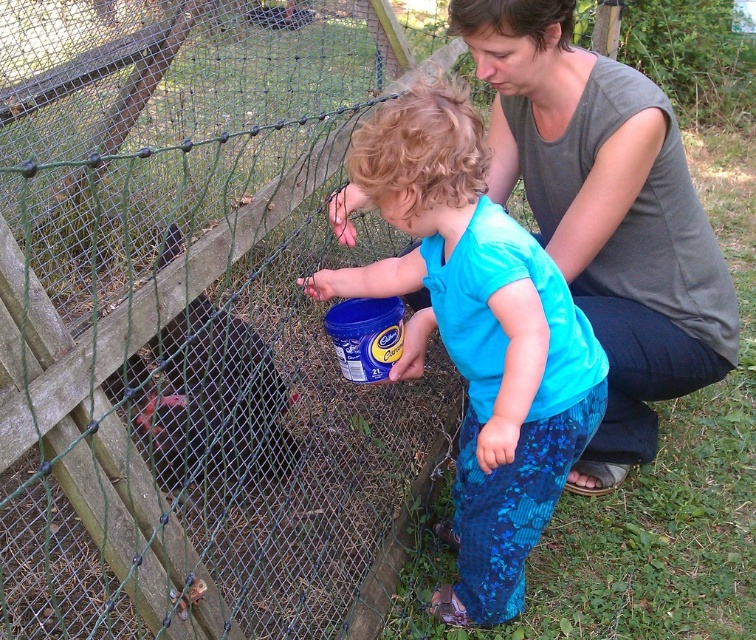
You are a photographer trying to capture a photo of the blue matte shirt at center and the gray cotton shirt at upper center. Which shirt should you focus on first if you want to ensure both shirts are in sharp focus?

The blue matte shirt at center is smaller than the gray cotton shirt at upper center, so you should focus on the gray cotton shirt at upper center first to ensure both are in sharp focus.

You are a photographer trying to capture a candid shot of the child and the woman. Since you want to focus on their interaction, you need to ensure that both the blue matte shirt at center and the gray cotton shirt at upper center are visible in the frame. Based on their positions, which shirt should you position closer to the left side of your camera viewfinder to include both in the photo?

The blue matte shirt at center is to the left of the gray cotton shirt at upper center, so to include both in the photo, position the blue matte shirt at center closer to the left side of the camera viewfinder.